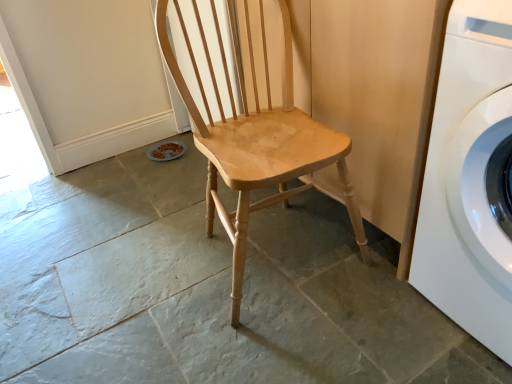
Locate an element on the screen. vacant space underneath natural wood chair at center (from a real-world perspective) is located at coordinates (272, 261).